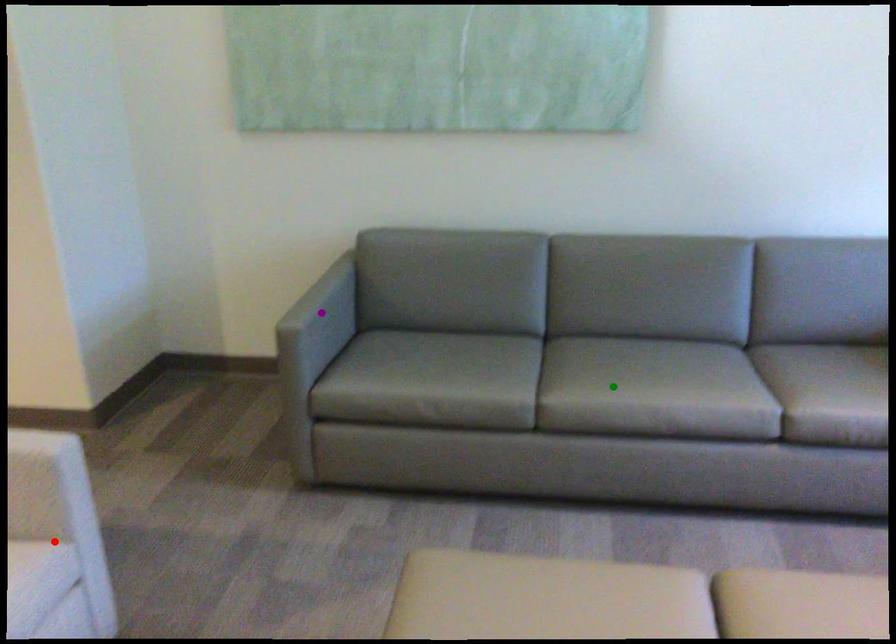
Order these from nearest to farthest:
red point | purple point | green point

red point < green point < purple point